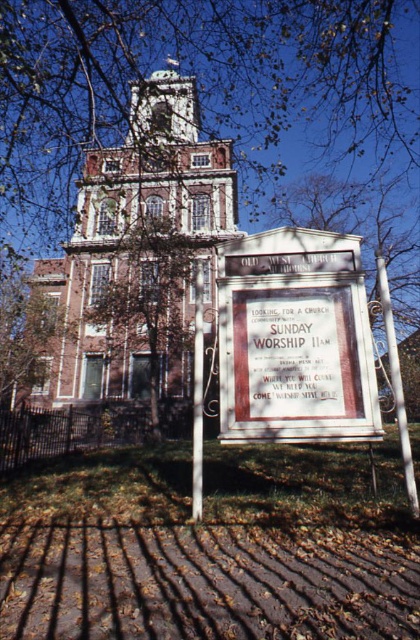
Question: Which point is closer to the camera taking this photo?

Choices:
 (A) (128, 10)
 (B) (341, 320)

Answer: (B)

Question: Is brown leafy tree at upper center below white wooden sign at center?

Choices:
 (A) no
 (B) yes

Answer: (A)

Question: Which of the following is the closest to the observer?

Choices:
 (A) (89, 74)
 (B) (260, 259)

Answer: (B)

Question: Does brown leafy tree at upper center have a lesser width compared to white wooden sign at center?

Choices:
 (A) no
 (B) yes

Answer: (A)

Question: Can you confirm if brown leafy tree at upper center is positioned to the left of white wooden sign at center?

Choices:
 (A) no
 (B) yes

Answer: (B)

Question: Which point is closer to the camera taking this photo?

Choices:
 (A) (270, 376)
 (B) (15, 179)

Answer: (A)